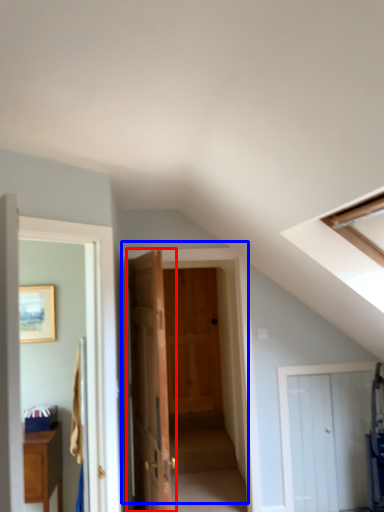
Question: Which point is closer to the camera, door (highlighted by a red box) or door (highlighted by a blue box)?

Choices:
 (A) door
 (B) door

Answer: (A)